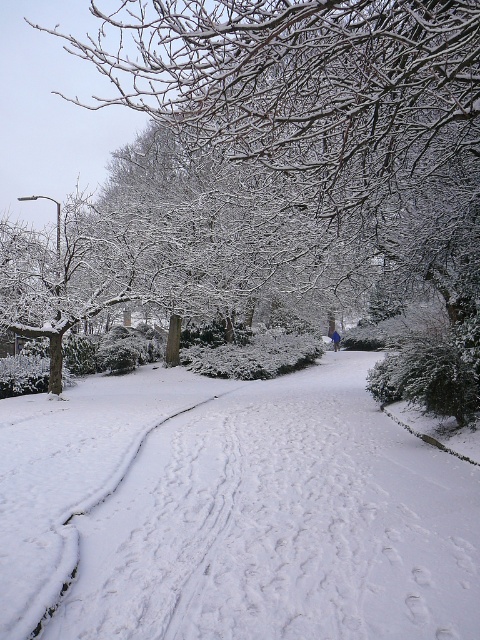
Who is more forward, (96,396) or (207,81)?

Positioned in front is point (207,81).

Measure the distance between point (254, 444) and camera.

Point (254, 444) and camera are 10.94 meters apart.

What do you see at coordinates (232, 513) in the screenshot?
I see `white fluffy snow at center` at bounding box center [232, 513].

Where is `white fluffy snow at center`? The width and height of the screenshot is (480, 640). white fluffy snow at center is located at coordinates 232,513.